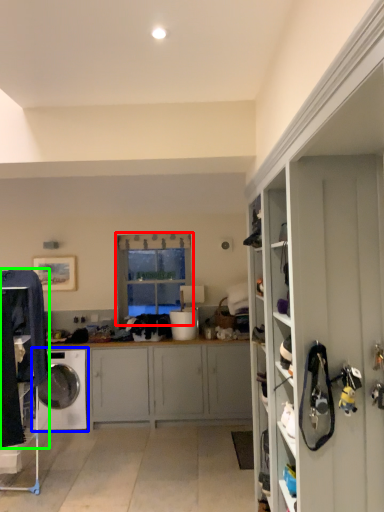
Question: Based on their relative distances, which object is farther from window (highlighted by a red box)? Choose from washing machine (highlighted by a blue box) and clothing (highlighted by a green box).

Choices:
 (A) washing machine
 (B) clothing

Answer: (B)